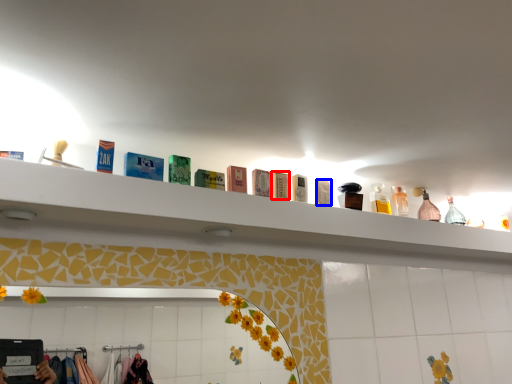
Question: Which object is further to the camera taking this photo, toiletry (highlighted by a red box) or toiletry (highlighted by a blue box)?

Choices:
 (A) toiletry
 (B) toiletry

Answer: (B)